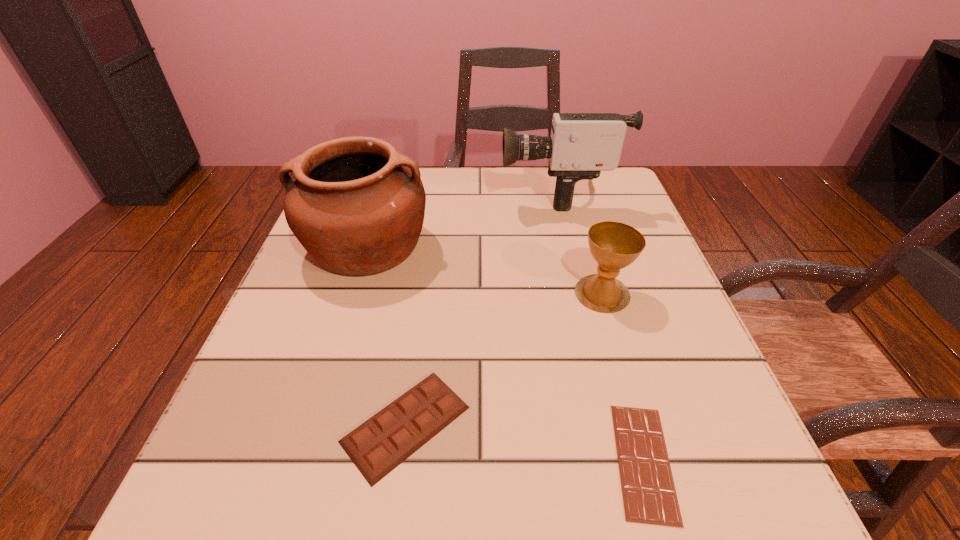
In order to click on free space located on the back of the pottery in this screenshot , I will do `click(388, 178)`.

Locate an element on the screen. vacant position located 0.140m on the left of the chalice is located at coordinates (499, 293).

Where is `blank area located 0.400m on the back of the second shortest object`? Image resolution: width=960 pixels, height=540 pixels. blank area located 0.400m on the back of the second shortest object is located at coordinates click(433, 223).

The width and height of the screenshot is (960, 540). Find the location of `free space located 0.320m on the back of the shortest object`. free space located 0.320m on the back of the shortest object is located at coordinates (588, 264).

Where is `camcorder that is at the far edge`? This screenshot has width=960, height=540. camcorder that is at the far edge is located at coordinates (581, 145).

What are the coordinates of `pottery that is at the far edge` in the screenshot? It's located at 357,206.

Where is `object that is at the left edge`? The width and height of the screenshot is (960, 540). object that is at the left edge is located at coordinates (357, 206).

Where is `camcorder at the right edge`? The image size is (960, 540). camcorder at the right edge is located at coordinates (581, 145).

The width and height of the screenshot is (960, 540). Find the location of `chalice that is at the right edge`. chalice that is at the right edge is located at coordinates (614, 245).

Image resolution: width=960 pixels, height=540 pixels. I want to click on chocolate bar present at the right edge, so click(x=649, y=495).